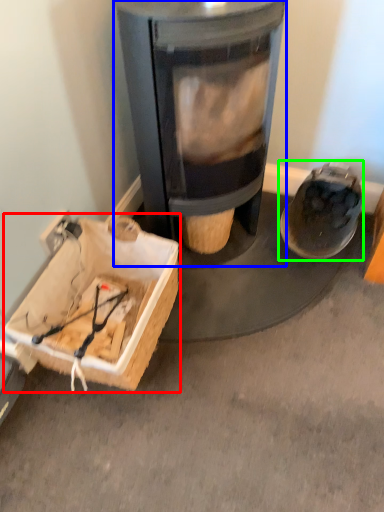
Question: Which object is the closest to the cardboard box (highlighted by a red box)? Choose among these: wood burning stove (highlighted by a blue box) or footwear (highlighted by a green box).

Choices:
 (A) wood burning stove
 (B) footwear

Answer: (A)